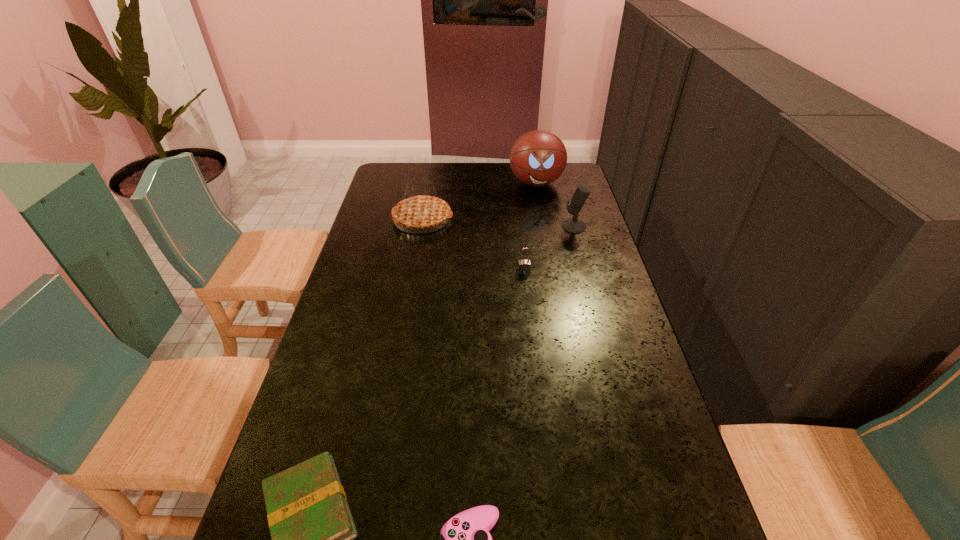
The image size is (960, 540). Find the location of `free space between the padlock and the basketball`. free space between the padlock and the basketball is located at coordinates (530, 227).

Locate which object ranks in proximity to the tallest object. Please provide its 2D coordinates. Your answer should be formatted as a tuple, i.e. [(x, y)], where the tuple contains the x and y coordinates of a point satisfying the conditions above.

[(574, 225)]

Identify which object is the third closest to the microphone. Please provide its 2D coordinates. Your answer should be formatted as a tuple, i.e. [(x, y)], where the tuple contains the x and y coordinates of a point satisfying the conditions above.

[(420, 211)]

Identify the location of free space in the image that satisfies the following two spatial constraints: 1. on the back side of the pie; 2. on the left side of the tallest object. The height and width of the screenshot is (540, 960). (429, 183).